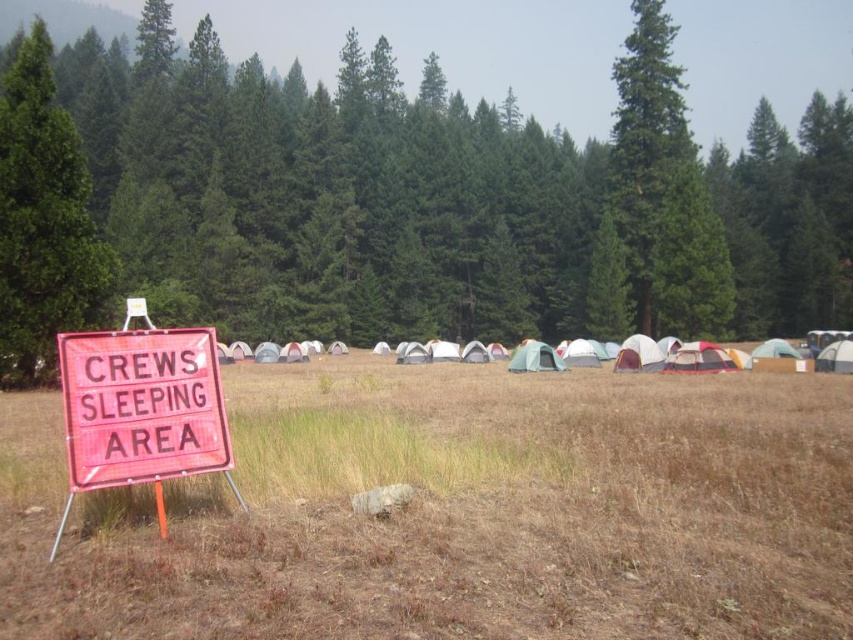
Question: Which is nearer to the pink plastic sign at left?

Choices:
 (A) white fabric tent at center
 (B) white fabric tents at center
 (C) green matte tree at center

Answer: (A)

Question: Is green matte tree at left further to camera compared to white fabric tent at center?

Choices:
 (A) no
 (B) yes

Answer: (A)

Question: Which object is the farthest from the green matte tree at left?

Choices:
 (A) white fabric tent at center
 (B) green matte tree at center

Answer: (B)

Question: Can you confirm if green matte tree at center is smaller than white fabric tent at center?

Choices:
 (A) no
 (B) yes

Answer: (A)

Question: Is pink plastic sign at left to the left of white fabric tent at center from the viewer's perspective?

Choices:
 (A) no
 (B) yes

Answer: (B)

Question: Which point is farther to the camera?

Choices:
 (A) (55, 180)
 (B) (88, 593)
 (C) (737, 352)
 (D) (543, 355)

Answer: (D)